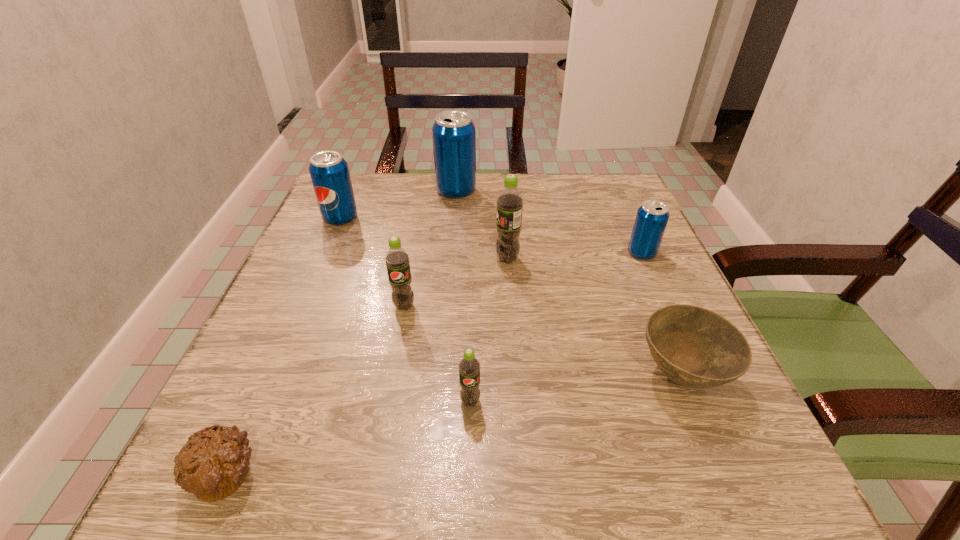
You are a GUI agent. You are given a task and a screenshot of the screen. Output one action in this format:
    pyautogui.click(x=<x>, y=<y>)
    Task: Click on the free space between the nearest object and the sixth object from left to right
    This screenshot has height=540, width=960.
    Given the screenshot: What is the action you would take?
    pyautogui.click(x=367, y=365)

The width and height of the screenshot is (960, 540). Find the location of `free spot between the second farthest green soda and the second farthest blue pop soda`. free spot between the second farthest green soda and the second farthest blue pop soda is located at coordinates (372, 262).

Find the location of a particular element. Image resolution: width=960 pixels, height=540 pixels. unoccupied area between the fifth farthest object and the seventh tallest object is located at coordinates (542, 340).

Find the location of a particular element. vacant region between the smallest blue pop soda and the second blue pop soda from left to right is located at coordinates (549, 222).

What are the coordinates of `free spot between the nearest green soda and the second shortest object` in the screenshot? It's located at (576, 388).

Locate an element on the screen. The height and width of the screenshot is (540, 960). vacant area that lies between the fourth nearest object and the seventh tallest object is located at coordinates (542, 340).

At what (x,y) coordinates should I click in order to perform the action: click on unoccupied area between the nearest object and the farthest green soda. Please return your answer as a coordinate pair (x, y). Looking at the image, I should click on (367, 365).

Where is `unoccupied area between the nearest green soda and the seventh tallest object`? This screenshot has width=960, height=540. unoccupied area between the nearest green soda and the seventh tallest object is located at coordinates point(576,388).

Point out which object is positioned as the sixth nearest to the second green soda from right to left. Please provide its 2D coordinates. Your answer should be formatted as a tuple, i.e. [(x, y)], where the tuple contains the x and y coordinates of a point satisfying the conditions above.

[(329, 172)]

The height and width of the screenshot is (540, 960). I want to click on object that stands as the closest to the muffin, so click(469, 366).